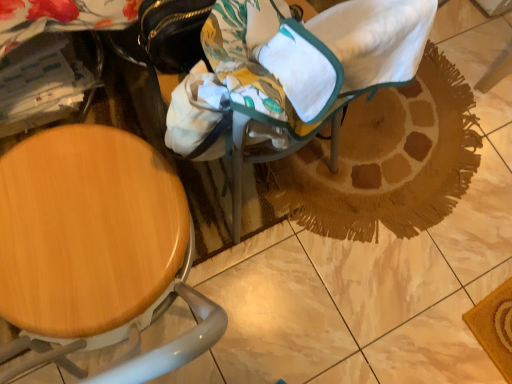
You are a GUI agent. You are given a task and a screenshot of the screen. Output one action in this format:
    pyautogui.click(x=<x>, y=<y>)
    Task: Click on the vacant space in brown woven mat at center (from a real-world perspective)
    The image size is (512, 384).
    Given the screenshot: What is the action you would take?
    pyautogui.click(x=391, y=162)